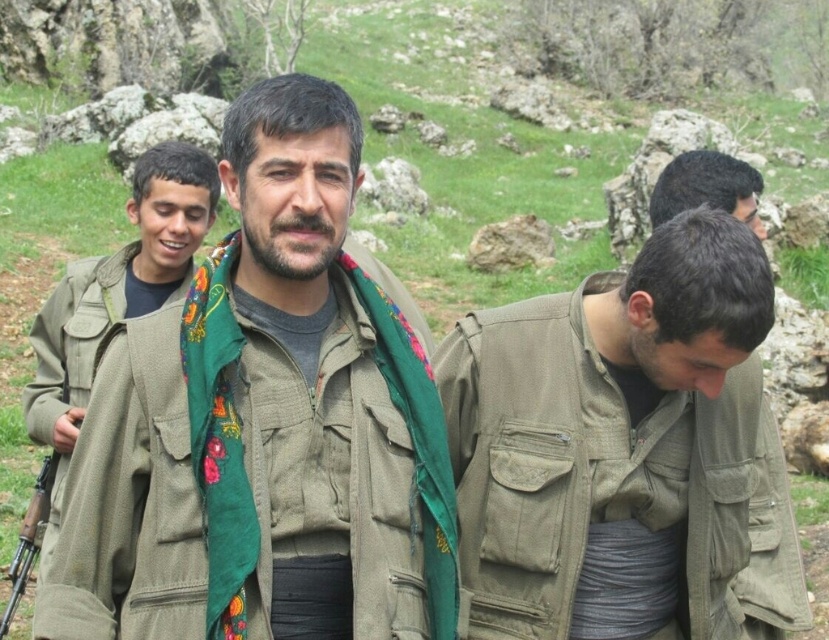
Question: Is matte green jacket at left bigger than green fabric scarf at center?

Choices:
 (A) no
 (B) yes

Answer: (B)

Question: Which of the following is the farthest from the observer?

Choices:
 (A) khaki fabric jacket at center
 (B) green fabric scarf at center
 (C) matte green jacket at left
 (D) matte olive green jacket at lower right

Answer: (C)

Question: Among these points, which one is nearest to the camera?

Choices:
 (A) (51, 356)
 (B) (767, 541)

Answer: (B)

Question: Which point is farther from the camera taking this photo?

Choices:
 (A) (784, 516)
 (B) (83, 380)
 (C) (81, 621)

Answer: (B)

Question: Is khaki fabric jacket at center to the left of matte olive green jacket at lower right from the viewer's perspective?

Choices:
 (A) yes
 (B) no

Answer: (A)

Question: Does khaki fabric jacket at center appear under matte green jacket at left?

Choices:
 (A) no
 (B) yes

Answer: (B)